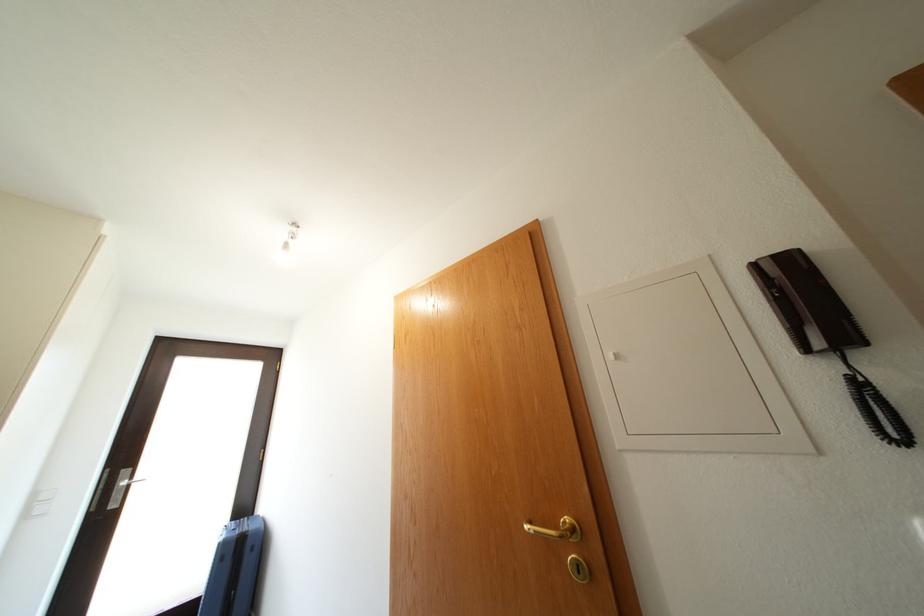
The height and width of the screenshot is (616, 924). I want to click on white light switch, so click(43, 521).